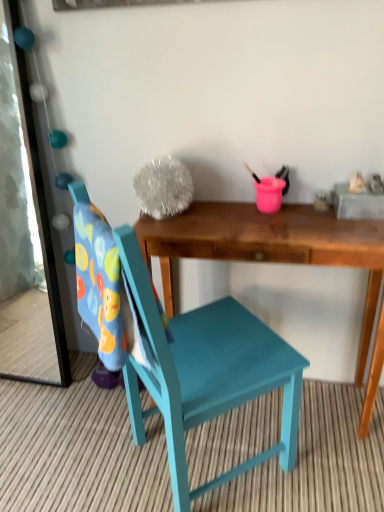
Question: Is metallic mirror at left completely or partially outside of wooden desk at center?

Choices:
 (A) yes
 (B) no

Answer: (A)

Question: Could wooden desk at center be considered to be inside metallic mirror at left?

Choices:
 (A) yes
 (B) no

Answer: (B)

Question: Is metallic mirror at left oriented away from wooden desk at center?

Choices:
 (A) no
 (B) yes

Answer: (A)

Question: From a real-world perspective, does metallic mirror at left sit lower than wooden desk at center?

Choices:
 (A) no
 (B) yes

Answer: (A)

Question: From the image's perspective, is metallic mirror at left under wooden desk at center?

Choices:
 (A) yes
 (B) no

Answer: (B)

Question: Is metallic mirror at left at the left side of wooden desk at center?

Choices:
 (A) yes
 (B) no

Answer: (A)

Question: Is teal painted wood chair at center aimed at metallic mirror at left?

Choices:
 (A) yes
 (B) no

Answer: (B)

Question: Is teal painted wood chair at center surrounding metallic mirror at left?

Choices:
 (A) yes
 (B) no

Answer: (B)

Question: Is teal painted wood chair at center not near metallic mirror at left?

Choices:
 (A) yes
 (B) no

Answer: (B)

Question: Is teal painted wood chair at center bigger than metallic mirror at left?

Choices:
 (A) no
 (B) yes

Answer: (B)

Question: From a real-world perspective, is teal painted wood chair at center located beneath metallic mirror at left?

Choices:
 (A) yes
 (B) no

Answer: (A)

Question: From a real-world perspective, is teal painted wood chair at center positioned over metallic mirror at left based on gravity?

Choices:
 (A) yes
 (B) no

Answer: (B)

Question: Can you confirm if wooden desk at center is wider than teal painted wood chair at center?

Choices:
 (A) yes
 (B) no

Answer: (B)